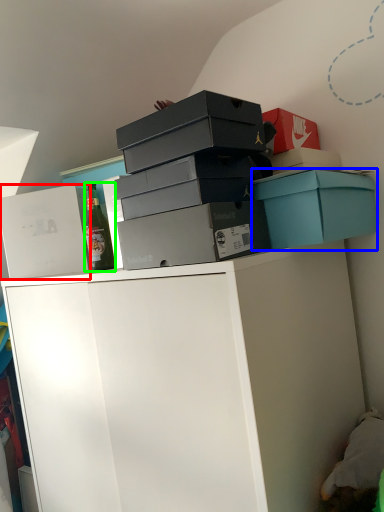
Question: Considering the real-world distances, which object is closest to box (highlighted by a red box)? box (highlighted by a blue box) or bottle (highlighted by a green box).

Choices:
 (A) box
 (B) bottle

Answer: (B)